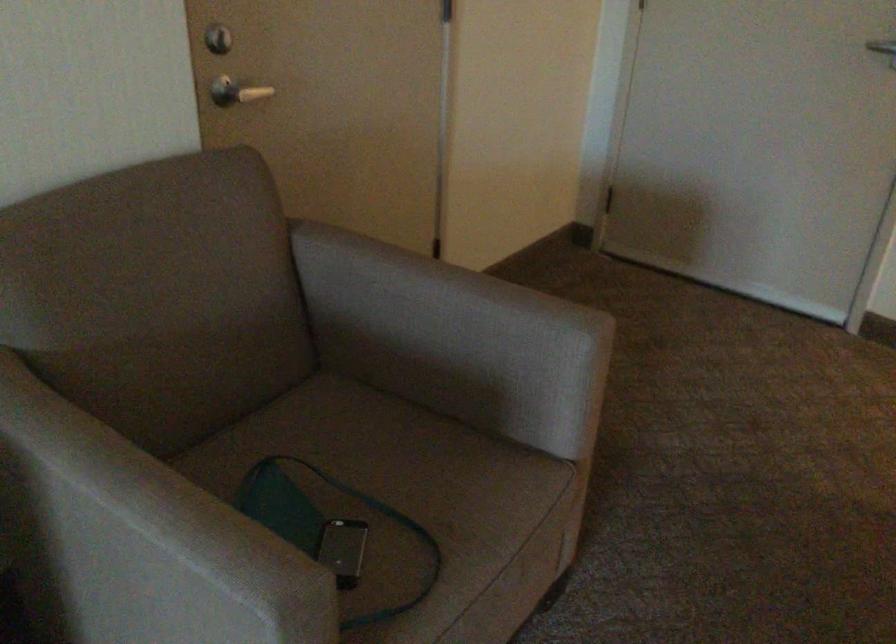
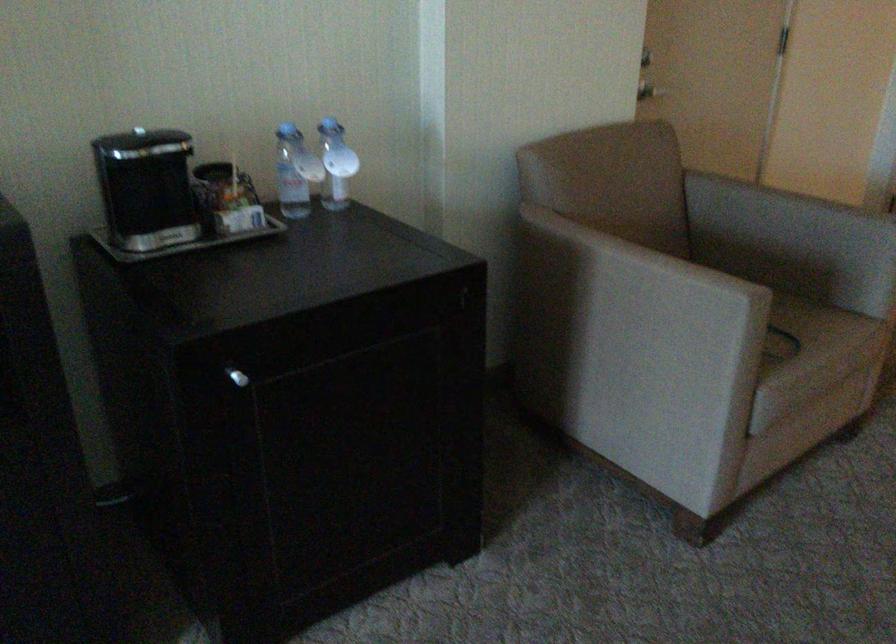
In the second image, find the point that corresponds to point (458, 545) in the first image.

(811, 335)